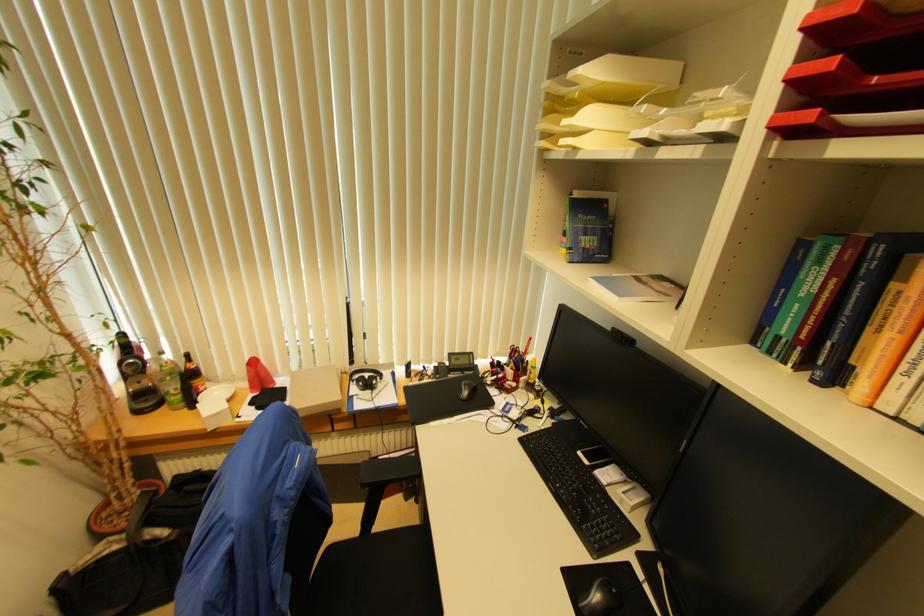
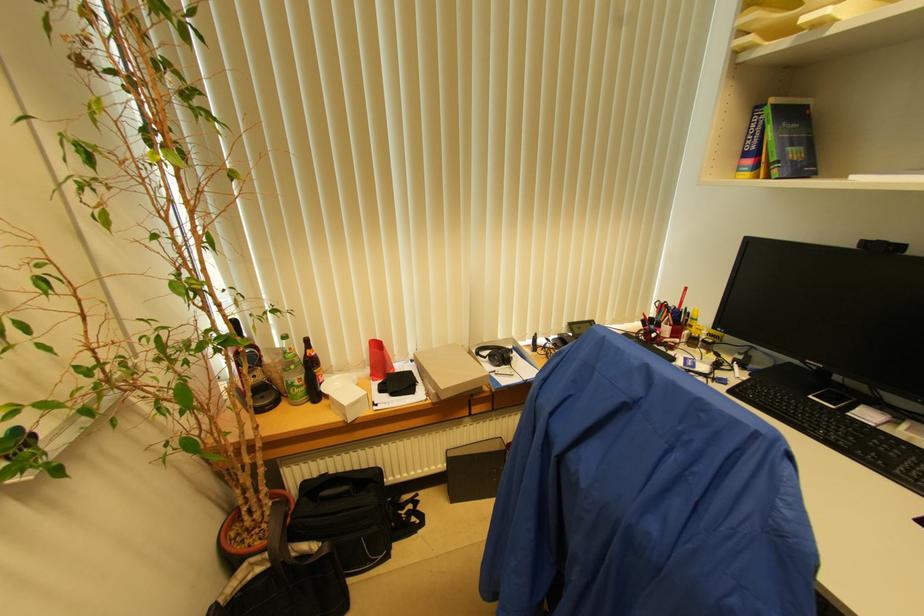
Where in the second image is the point corresponding to point (180, 389) from the first image?

(304, 379)